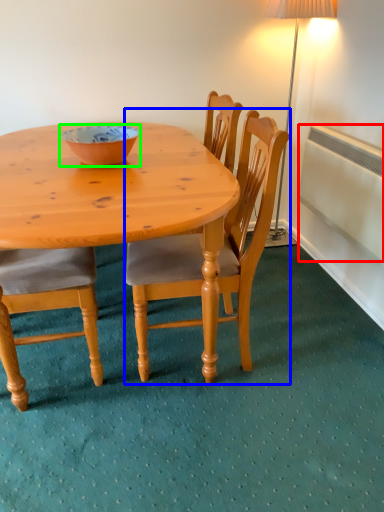
Question: Considering the real-world distances, which object is closest to radiator (highlighted by a red box)? chair (highlighted by a blue box) or bowl (highlighted by a green box).

Choices:
 (A) chair
 (B) bowl

Answer: (A)